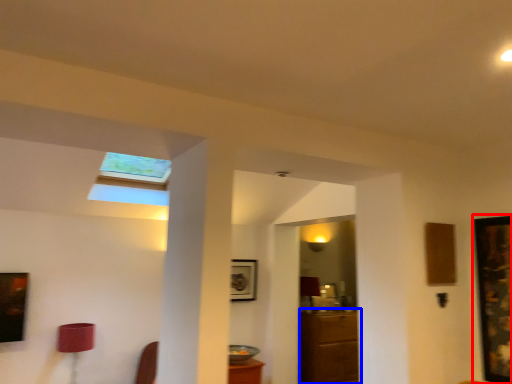
Question: Which of the following is the closest to the observer, picture frame (highlighted by a red box) or furniture (highlighted by a blue box)?

Choices:
 (A) picture frame
 (B) furniture

Answer: (A)